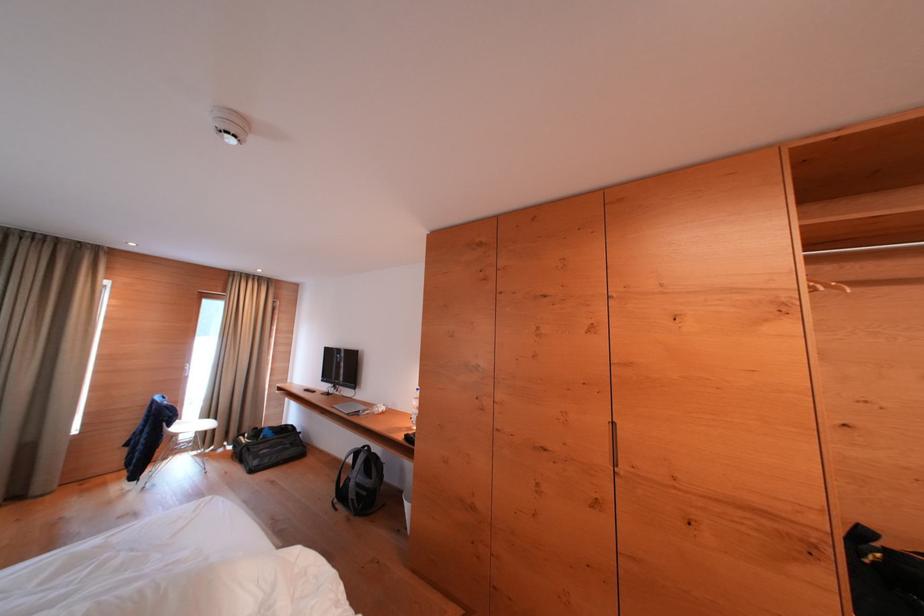
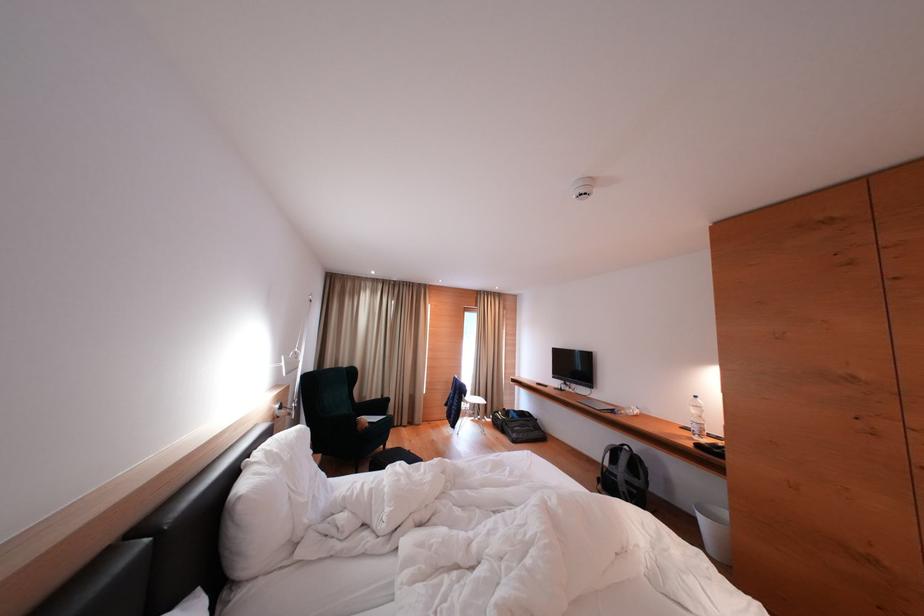
Where in the second image is the point corresponding to the point at 199,429 from the first image?

(477, 402)